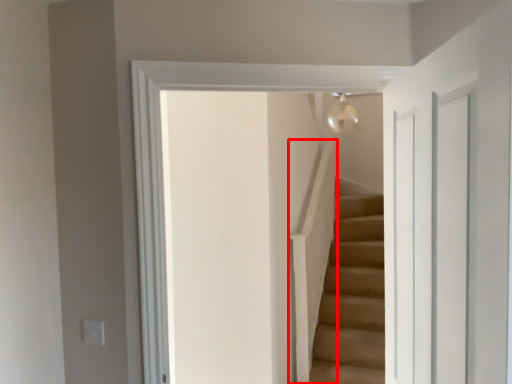
Question: Observing the image, what is the correct spatial positioning of balustrade (annotated by the red box) in reference to glass door?

Choices:
 (A) left
 (B) right

Answer: (B)